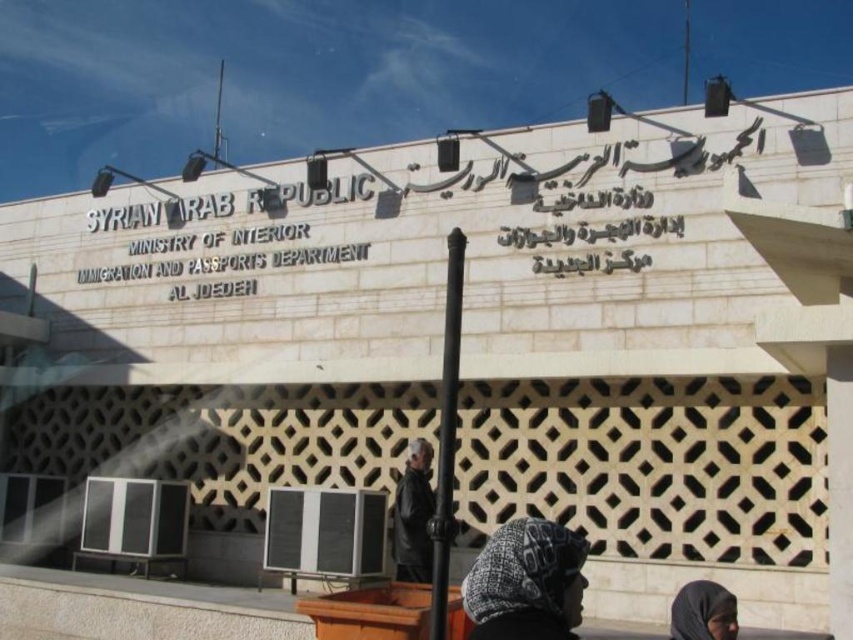
Is knitted woolen hat at lower center below black fabric headscarf at lower right?

Actually, knitted woolen hat at lower center is above black fabric headscarf at lower right.

Which is behind, point (471, 621) or point (732, 609)?

The point (471, 621) is more distant.

Locate an element on the screen. knitted woolen hat at lower center is located at coordinates (526, 582).